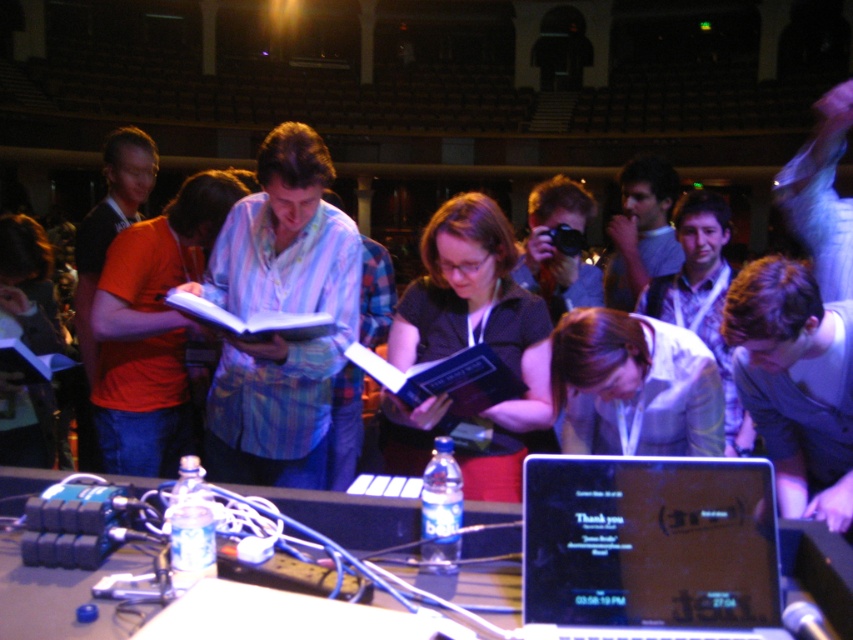
Does white glossy shirt at lower center have a lesser width compared to blue hardcover book at center?

No.

Is point (691, 342) positioned behind point (354, 364)?

No, (691, 342) is in front of (354, 364).

Is point (567, 340) more distant than point (473, 369)?

That is False.

You are a GUI agent. You are given a task and a screenshot of the screen. Output one action in this format:
    pyautogui.click(x=<x>, y=<y>)
    Task: Click on the white glossy shirt at lower center
    
    Given the screenshot: What is the action you would take?
    pyautogui.click(x=634, y=387)

Which of these two, white glossy shirt at lower center or clear plastic water bottle at center, stands taller?

Standing taller between the two is white glossy shirt at lower center.

Can you confirm if white glossy shirt at lower center is positioned below clear plastic water bottle at center?

No.

Is point (682, 436) closer to viewer compared to point (20, 512)?

No, (682, 436) is further to viewer.

Identify the location of white glossy shirt at lower center. (634, 387).

Can you confirm if black plastic laptop at center is positioned to the left of matte black book at center?

Incorrect, black plastic laptop at center is not on the left side of matte black book at center.

Can you confirm if black plastic laptop at center is thinner than matte black book at center?

Correct, black plastic laptop at center's width is less than matte black book at center's.

Is point (743, 563) less distant than point (511, 243)?

Yes, it is in front of point (511, 243).

You are a GUI agent. You are given a task and a screenshot of the screen. Output one action in this format:
    pyautogui.click(x=<x>, y=<y>)
    Task: Click on the black plastic laptop at center
    
    Given the screenshot: What is the action you would take?
    pyautogui.click(x=648, y=547)